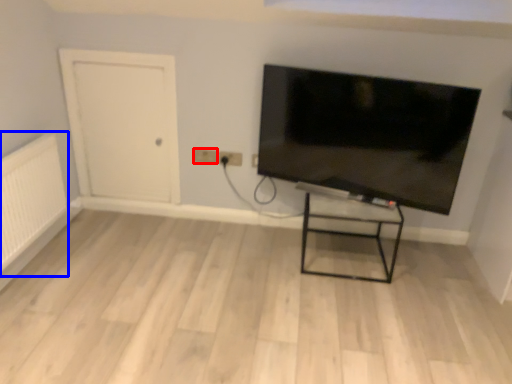
Question: Among these objects, which one is farthest to the camera, electric outlet (highlighted by a red box) or radiator (highlighted by a blue box)?

Choices:
 (A) electric outlet
 (B) radiator

Answer: (A)